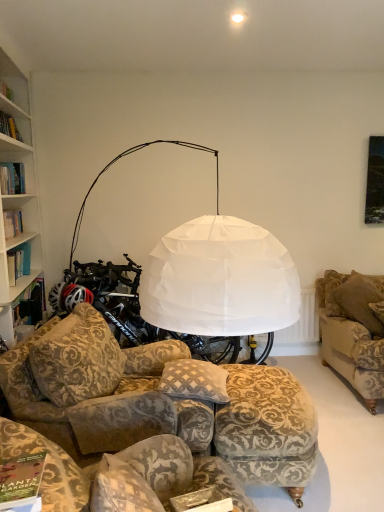
Question: Which is correct: white fabric lampshade at upper center is inside velvet floral-patterned couch at center, the 1th studio couch in the left-to-right sequence, or outside of it?

Choices:
 (A) inside
 (B) outside

Answer: (B)

Question: Is white fabric lampshade at upper center wider or thinner than velvet floral-patterned couch at center, the 2th studio couch from the right?

Choices:
 (A) wide
 (B) thin

Answer: (B)

Question: Estimate the real-world distances between objects in this image. Which object is closer to the white fabric lampshade at upper center?

Choices:
 (A) velvet floral-patterned couch at center, the 2th studio couch from the right
 (B) brown fabric pillow at right, marked as the first pillow in a back-to-front arrangement
 (C) velvet-patterned couch at lower center, the 1th studio couch positioned from the right
 (D) velvet floral ottoman at lower center
 (E) patterned fabric pillow at center, which is the 1th pillow in front-to-back order

Answer: (B)

Question: Estimate the real-world distances between objects in this image. Which object is closer to the brown fabric pillow at right, marked as the first pillow in a back-to-front arrangement?

Choices:
 (A) velvet floral-patterned couch at center, the 1th studio couch in the left-to-right sequence
 (B) white fabric lampshade at upper center
 (C) velvet floral ottoman at lower center
 (D) patterned fabric pillow at center, the second pillow from the right
 (E) matte green book at lower left

Answer: (C)